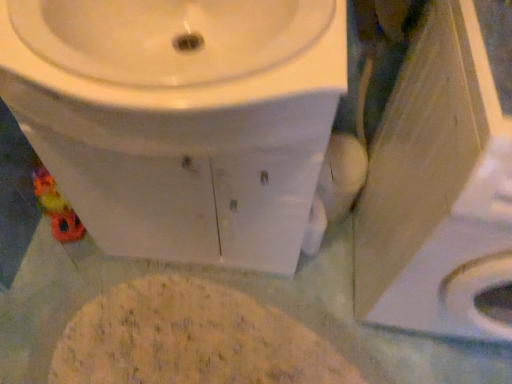
Question: In terms of size, does white glossy sink at upper center appear bigger or smaller than yellowish powder at center?

Choices:
 (A) small
 (B) big

Answer: (B)

Question: Relative to yellowish powder at center, is white glossy sink at upper center in front or behind?

Choices:
 (A) behind
 (B) front

Answer: (B)

Question: Which object is the farthest from the yellowish powder at center?

Choices:
 (A) white glossy sink at upper center
 (B) white glossy toilet at center

Answer: (A)

Question: Estimate the real-world distances between objects in this image. Which object is farther from the white glossy toilet at center?

Choices:
 (A) white glossy sink at upper center
 (B) yellowish powder at center

Answer: (B)